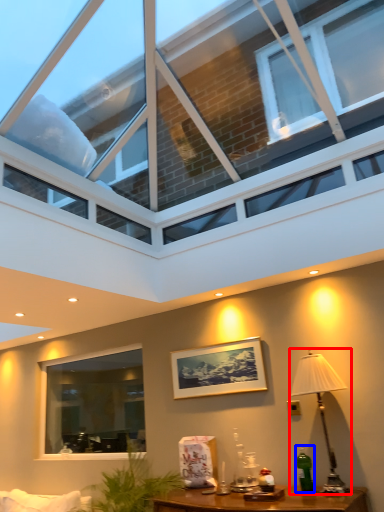
Question: Which object appears closest to the camera in this image, table lamp (highlighted by a red box) or bottle (highlighted by a blue box)?

Choices:
 (A) table lamp
 (B) bottle

Answer: (A)